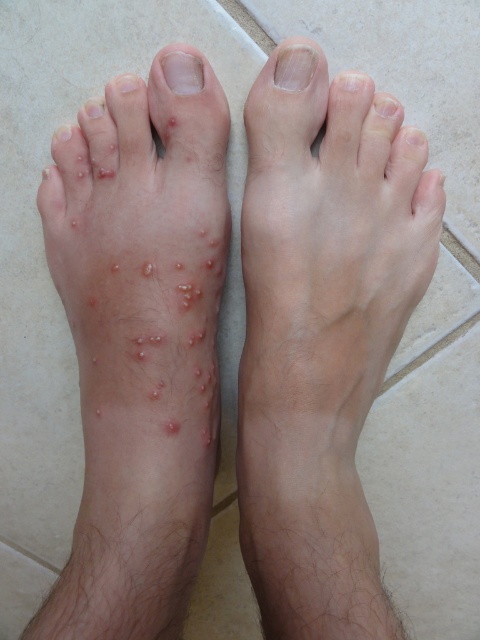
You are a dermatologist examining a patient. You notice two areas of concern on their legs. The smooth skin leg at center and the dry skin at upper right. Which area has a larger affected region?

The smooth skin leg at center has a larger affected region compared to the dry skin at upper right.

You are a medical professional examining a patient with a skin condition. You notice the smooth skin leg at center and the clear nail at upper left. Which of these two body parts is more likely to be affected by the visible skin condition described in the scene?

The smooth skin leg at center is more likely to be affected by the skin condition because the description mentions numerous small, raised, red bumps and irritated skin on the left foot, while the right foot has smooth skin. The clear nail at upper left shows no visible issues.